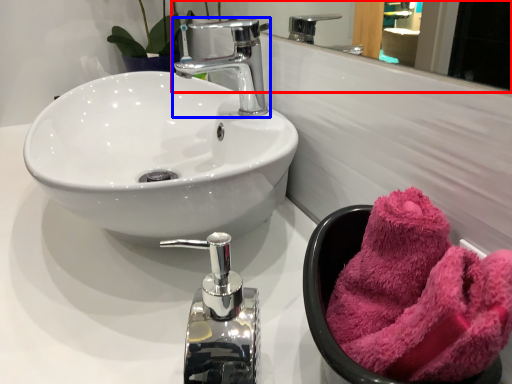
Question: Which object is further to the camera taking this photo, mirror (highlighted by a red box) or tap (highlighted by a blue box)?

Choices:
 (A) mirror
 (B) tap

Answer: (B)